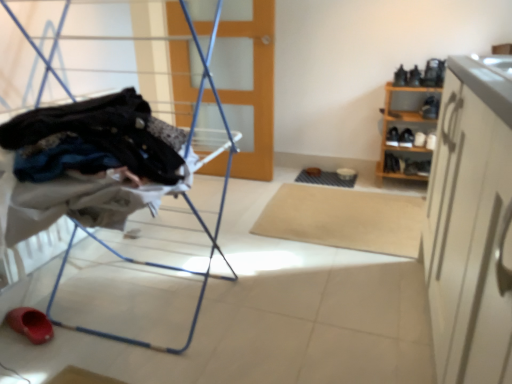
This screenshot has height=384, width=512. I want to click on vacant space underneath metal laundry rack at left (from a real-world perspective), so click(144, 296).